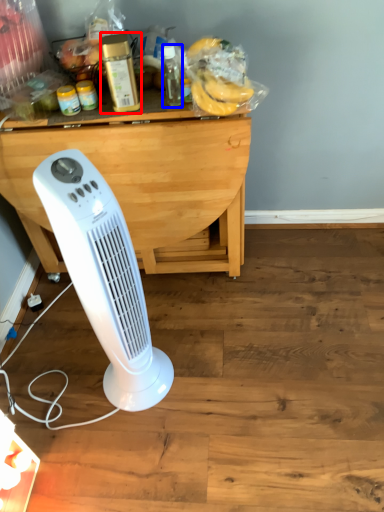
Question: Which of the following is the farthest to the observer, bottle (highlighted by a red box) or bottle (highlighted by a blue box)?

Choices:
 (A) bottle
 (B) bottle

Answer: (B)